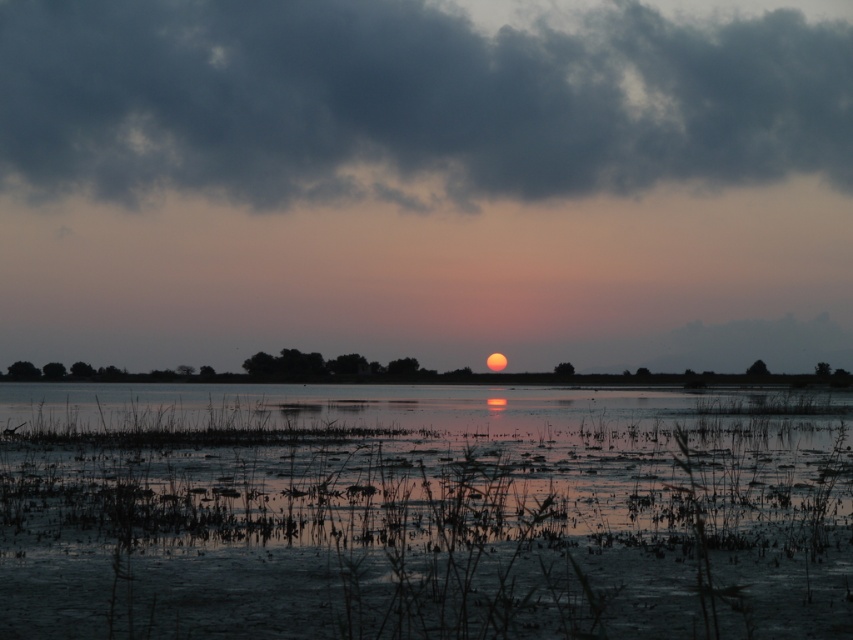
Does reflective wetland at center appear under dark gray cloud at upper center?

Indeed, reflective wetland at center is positioned under dark gray cloud at upper center.

Is point (140, 577) positioned behind point (751, 77)?

No, (140, 577) is in front of (751, 77).

Which is in front, point (376, 497) or point (577, 157)?

Point (376, 497) is in front.

I want to click on reflective wetland at center, so click(x=422, y=513).